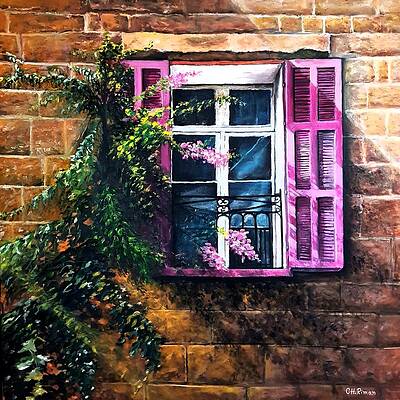
The image size is (400, 400). I want to click on plant, so click(x=55, y=318).